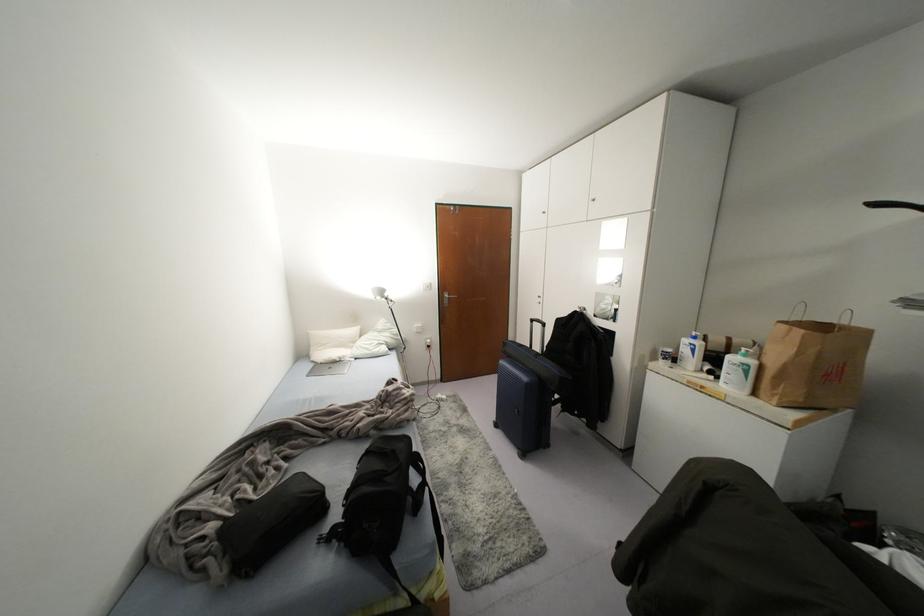
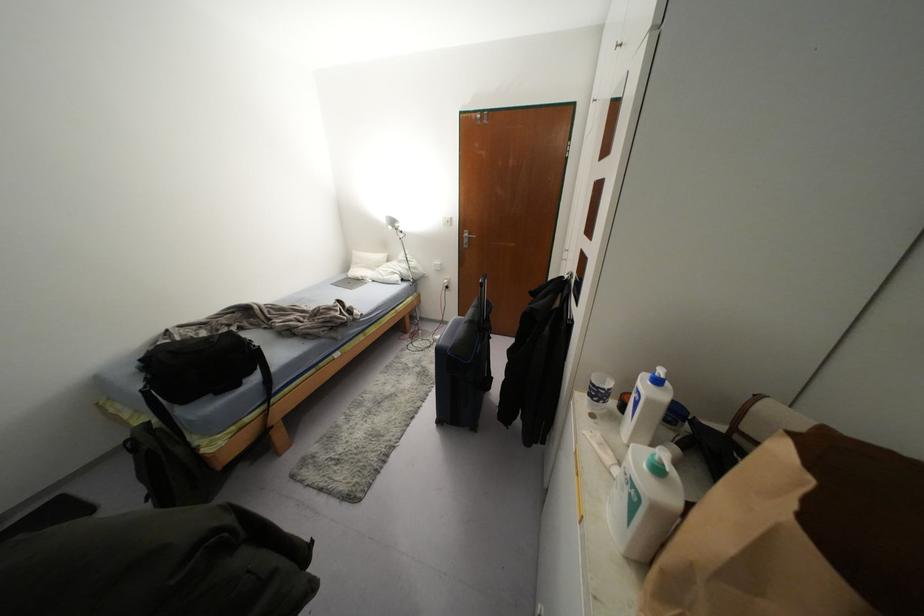
The point at [354,330] is marked in the first image. Where is the corresponding point in the second image?

(382, 256)